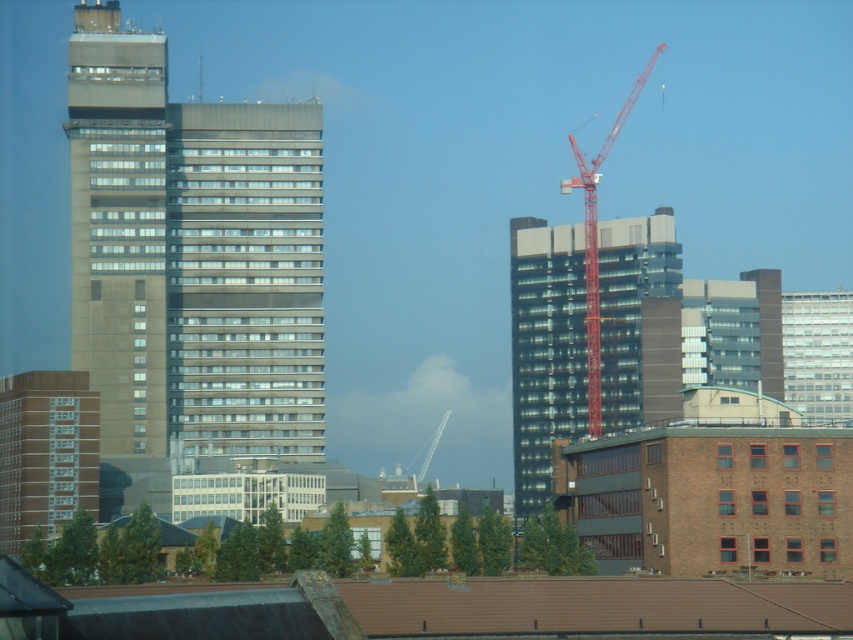
I want to click on glassy black building at center, so click(x=544, y=349).

Does brown brick building at lower left appear on the right side of red metal crane at upper right?

In fact, brown brick building at lower left is to the left of red metal crane at upper right.

Is brown brick building at lower left closer to camera compared to red metal crane at upper right?

Yes, it is.

Between point (82, 417) and point (607, 132), which one is positioned in front?

Positioned in front is point (82, 417).

At what (x,y) coordinates should I click in order to perform the action: click on brown brick building at lower left. Please return your answer as a coordinate pair (x, y). The height and width of the screenshot is (640, 853). Looking at the image, I should click on (45, 452).

Between concrete building at left and red metal crane at upper right, which one appears on the left side from the viewer's perspective?

From the viewer's perspective, concrete building at left appears more on the left side.

Can you confirm if concrete building at left is shorter than red metal crane at upper right?

Yes.

Image resolution: width=853 pixels, height=640 pixels. Describe the element at coordinates (190, 257) in the screenshot. I see `concrete building at left` at that location.

This screenshot has width=853, height=640. Identify the location of concrete building at left. tap(190, 257).